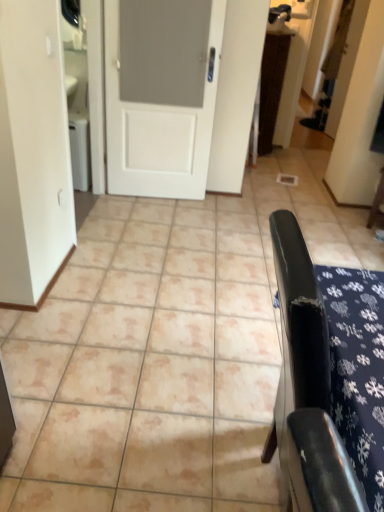
Question: From the image's perspective, is beige ceramic tile at center positioned above or below black leather chair at right, acting as the 2th furniture starting from the right?

Choices:
 (A) below
 (B) above

Answer: (B)

Question: Considering the positions of beige ceramic tile at center and black leather chair at right, which appears as the 2th furniture when viewed from the back, in the image, is beige ceramic tile at center wider or thinner than black leather chair at right, which appears as the 2th furniture when viewed from the back,?

Choices:
 (A) thin
 (B) wide

Answer: (B)

Question: Which of these objects is positioned closest to the brown textured rug at upper center?

Choices:
 (A) black leather chair at right, acting as the 2th furniture starting from the right
 (B) white matte door at center
 (C) beige ceramic tile at center
 (D) wooden chair at right, which is counted as the 1th furniture, starting from the right

Answer: (B)

Question: Based on their relative distances, which object is farther from the black leather chair at right, the 1th furniture positioned from the front?

Choices:
 (A) beige ceramic tile at center
 (B) white matte door at center
 (C) wooden chair at right, which appears as the second furniture when viewed from the left
 (D) brown textured rug at upper center

Answer: (D)